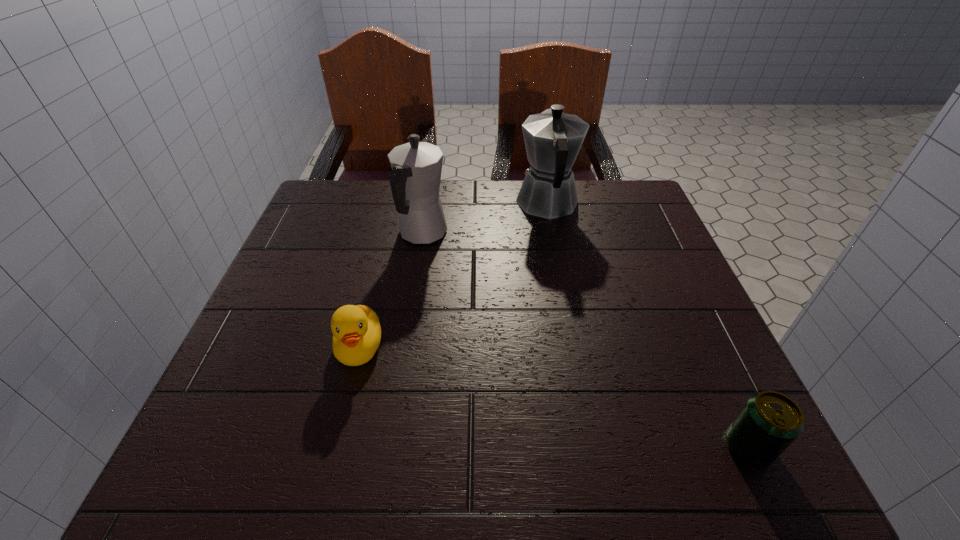
This screenshot has height=540, width=960. Find the location of `the second object from right to left`. the second object from right to left is located at coordinates (553, 139).

Where is `the left coffeepot`? The width and height of the screenshot is (960, 540). the left coffeepot is located at coordinates (416, 166).

Identify the location of duck. The width and height of the screenshot is (960, 540). (356, 330).

Image resolution: width=960 pixels, height=540 pixels. In order to click on the nearest object in this screenshot , I will do `click(769, 422)`.

Image resolution: width=960 pixels, height=540 pixels. Find the location of `beer can`. beer can is located at coordinates (769, 422).

You are a GUI agent. You are given a task and a screenshot of the screen. Output one action in this format:
    pyautogui.click(x=<x>, y=<y>)
    Task: Click on the vacant space located on the right of the left coffeepot
    
    Given the screenshot: What is the action you would take?
    (x=512, y=234)

At what (x,y) coordinates should I click in order to perform the action: click on free location located at the beak of the duck. Please return your answer as a coordinate pair (x, y). Image resolution: width=960 pixels, height=540 pixels. Looking at the image, I should click on (334, 450).

Where is `free location located 0.220m on the left of the nearest object`? Image resolution: width=960 pixels, height=540 pixels. free location located 0.220m on the left of the nearest object is located at coordinates (586, 447).

In order to click on object that is positioned at the near edge in this screenshot , I will do `click(769, 422)`.

Where is `object at the right edge`? The image size is (960, 540). object at the right edge is located at coordinates (769, 422).